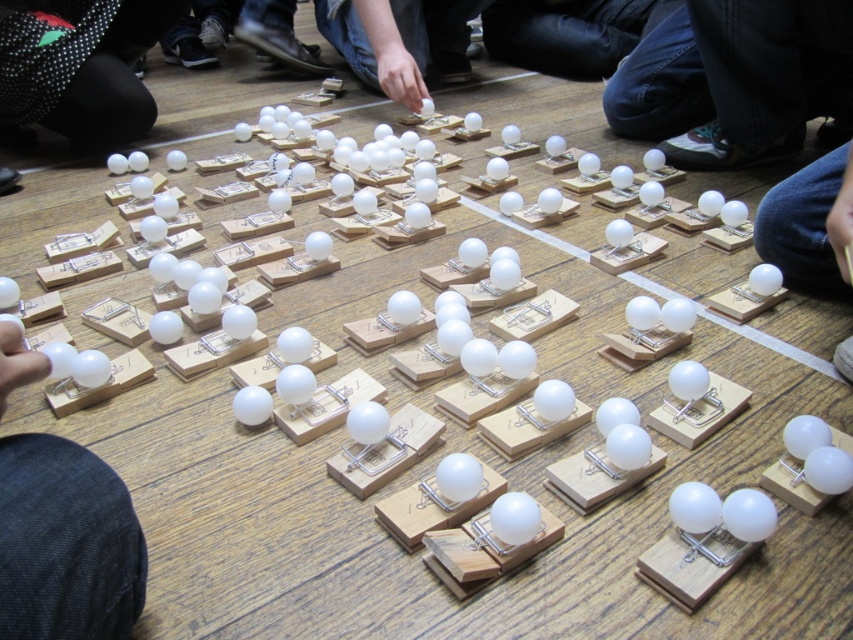
Which of these two, white matte ping pong ball at lower left or white matte ping pong ball at lower right, stands taller?

Standing taller between the two is white matte ping pong ball at lower right.

Where is `white matte ping pong ball at lower left`? white matte ping pong ball at lower left is located at coordinates (65, 544).

Who is more distant from viewer, (39, 592) or (809, 268)?

The point (809, 268) is behind.

This screenshot has width=853, height=640. Find the location of `white matte ping pong ball at lower left`. white matte ping pong ball at lower left is located at coordinates (65, 544).